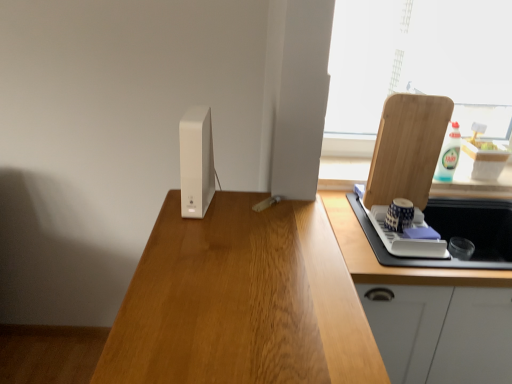
This screenshot has width=512, height=384. I want to click on vacant space positioned to the left of wooden cutting board at right, so click(x=347, y=210).